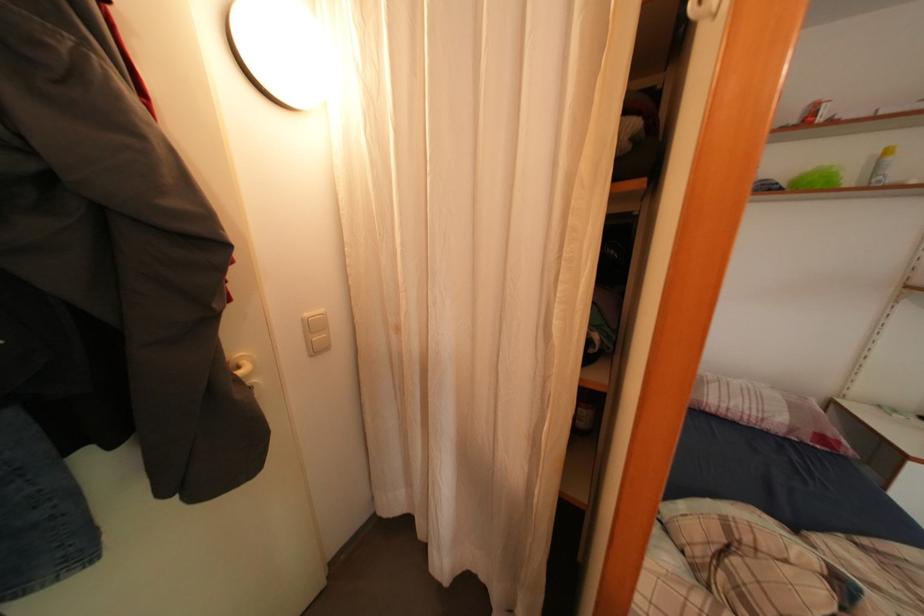
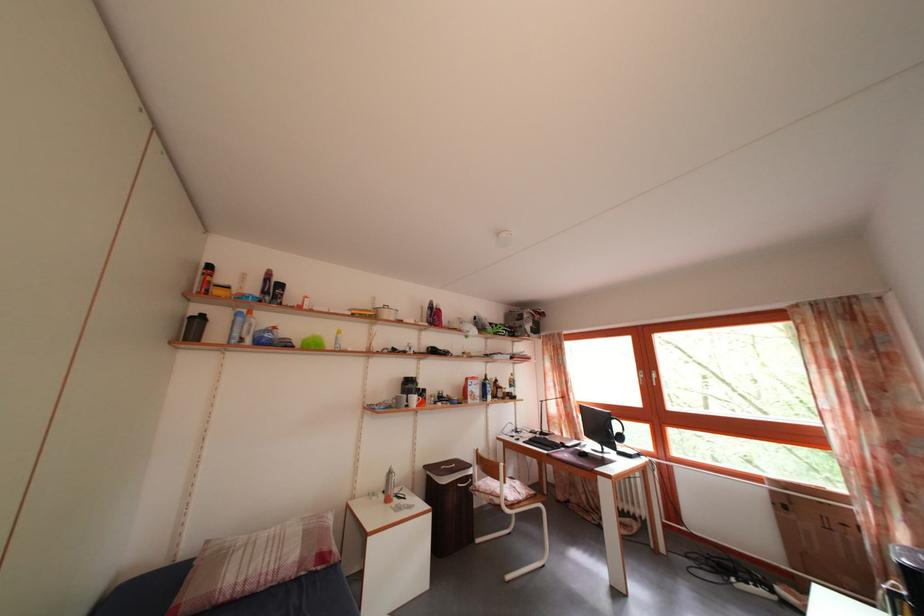
In the second image, find the point that corresponds to (740,424) in the first image.

(257, 594)